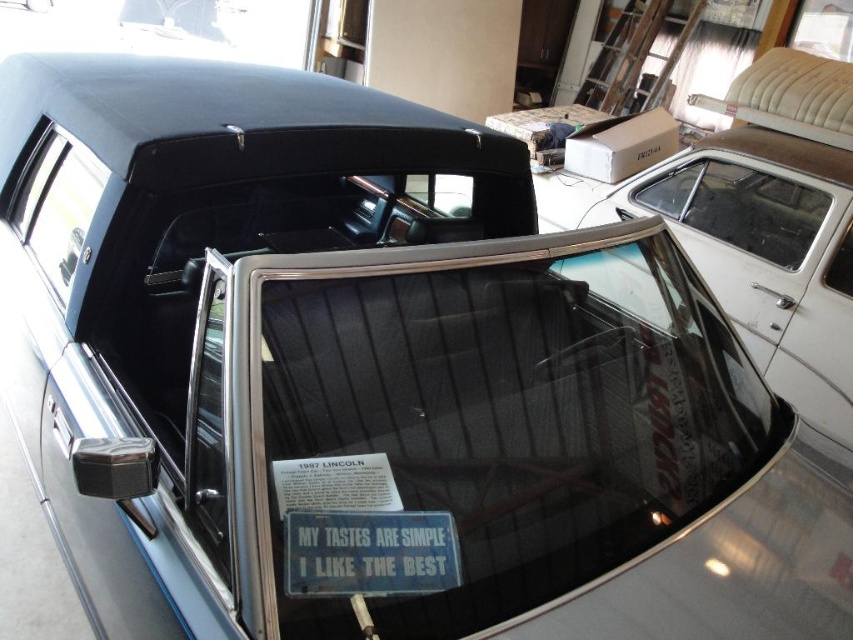
What is located at the coordinates point (369, 554)?

The blue metallic sign at center is located at point (369, 554).

You are a painter standing in front of the car and want to paint the area behind the point at coordinates point (660, 180). Can you paint that area without painting over point (51, 264)?

Point (660, 180) is behind point (51, 264), so you can paint the area behind point (660, 180) without painting over point (51, 264) because it is farther away.